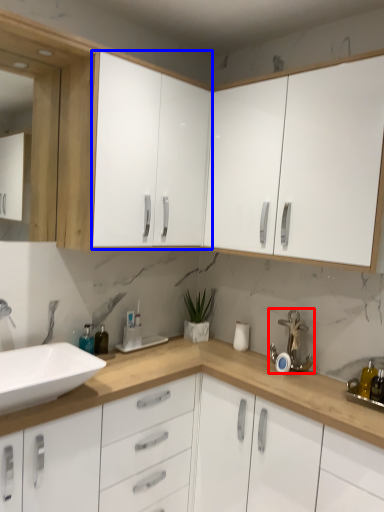
Question: Which object appears farthest to the camera in this image, faucet (highlighted by a red box) or cabinetry (highlighted by a blue box)?

Choices:
 (A) faucet
 (B) cabinetry

Answer: (A)